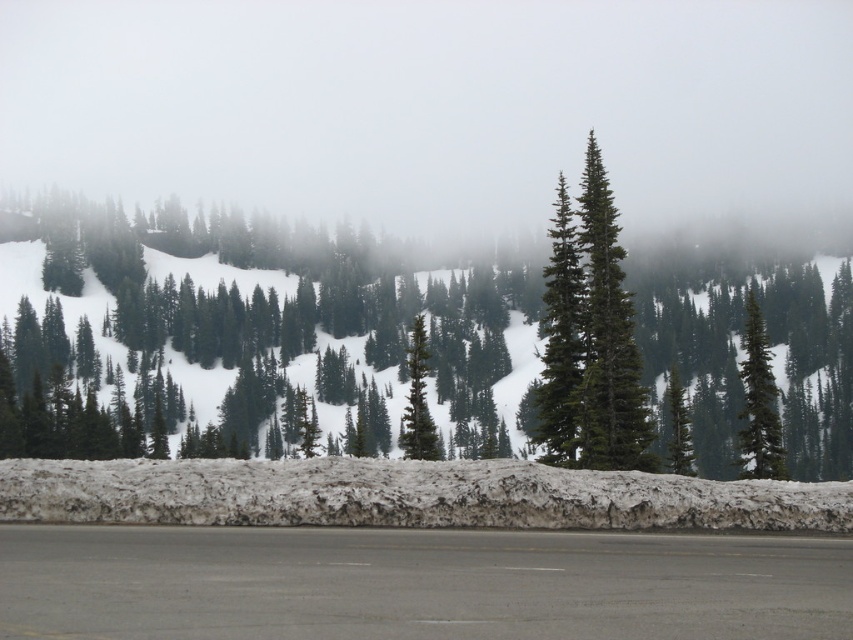
Can you confirm if gray asphalt highway at lower center is positioned to the right of green matte tree at center-right?

In fact, gray asphalt highway at lower center is to the left of green matte tree at center-right.

Which is more to the left, gray asphalt highway at lower center or green matte tree at center-right?

From the viewer's perspective, gray asphalt highway at lower center appears more on the left side.

Is point (418, 577) closer to viewer compared to point (759, 449)?

That is True.

Image resolution: width=853 pixels, height=640 pixels. Identify the location of gray asphalt highway at lower center. (416, 582).

Between point (668, 618) and point (416, 387), which one is positioned behind?

The point (416, 387) is behind.

Measure the distance between gray asphalt highway at lower center and green matte tree at center.

A distance of 101.35 feet exists between gray asphalt highway at lower center and green matte tree at center.

Identify the location of gray asphalt highway at lower center. The width and height of the screenshot is (853, 640). (416, 582).

Can you confirm if green matte evergreen tree at center is positioned above green matte tree at center-right?

Yes, green matte evergreen tree at center is above green matte tree at center-right.

Between point (618, 291) and point (740, 368), which one is positioned in front?

Positioned in front is point (618, 291).

Locate an element on the screen. Image resolution: width=853 pixels, height=640 pixels. green matte evergreen tree at center is located at coordinates (590, 339).